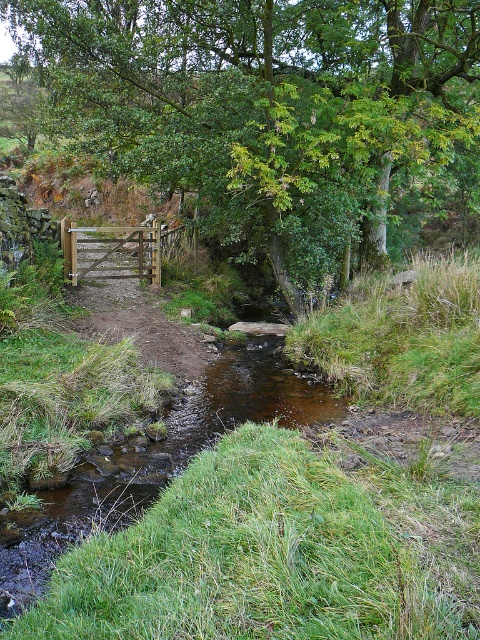
You are standing at the entrance of the path and want to walk towards the stream. Which object, the green leafy tree at upper center or the brown wooden gate at center, will you pass first?

The brown wooden gate at center is located closer to the entrance of the path, so you will pass the brown wooden gate at center first before reaching the green leafy tree at upper center.

You are standing on the path near the wooden gate and want to walk towards the stream. There are two points marked on your map as point [315,83] and point [168,346]. Which point is closer to you as you face the stream?

Point [315,83] is closer to you because it is further to the viewer than point [168,346], meaning it is nearer in the scene.

You are standing at the wooden gate and want to walk directly towards the green leafy tree at upper center. Which direction should you head? Please provide your answer in terms of the 2D coordinate system where the origin is at the bottom left corner of the image, with the x and y axes increasing to the right and upwards respectively.

You should head towards the coordinate point of 0.173 in the x direction and 0.567 in the y direction to reach the green leafy tree at upper center.